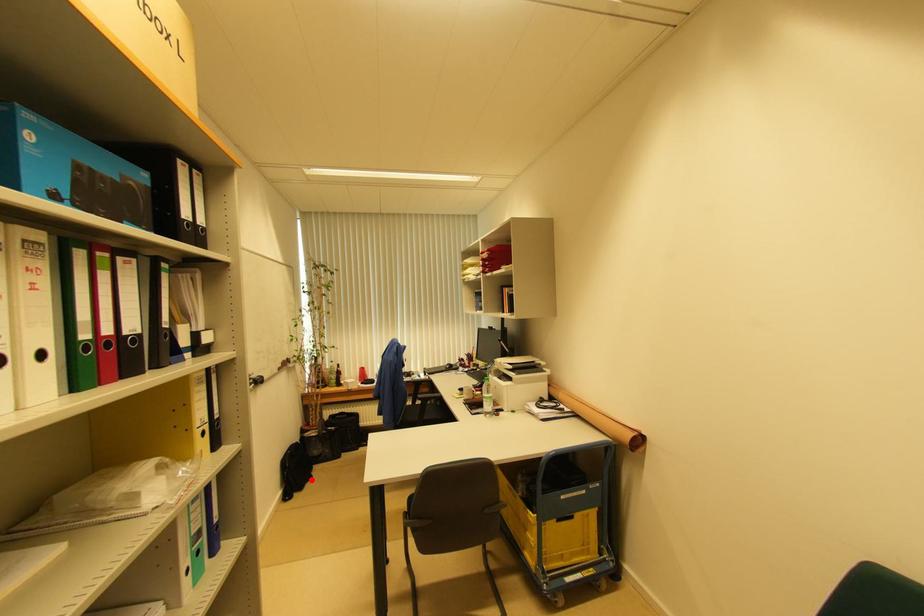
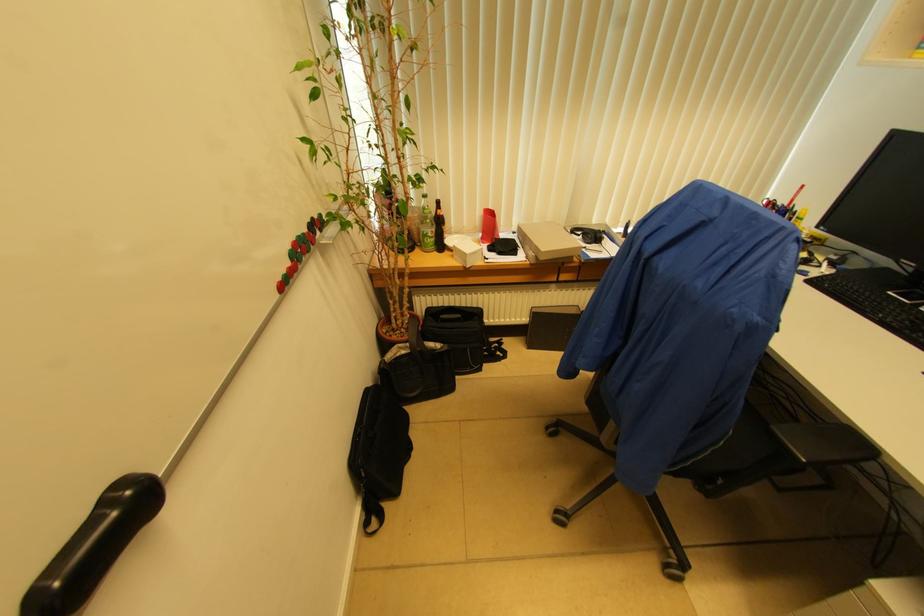
Where in the second image is the point corresponding to the highlighted location from the first image?

(409, 451)